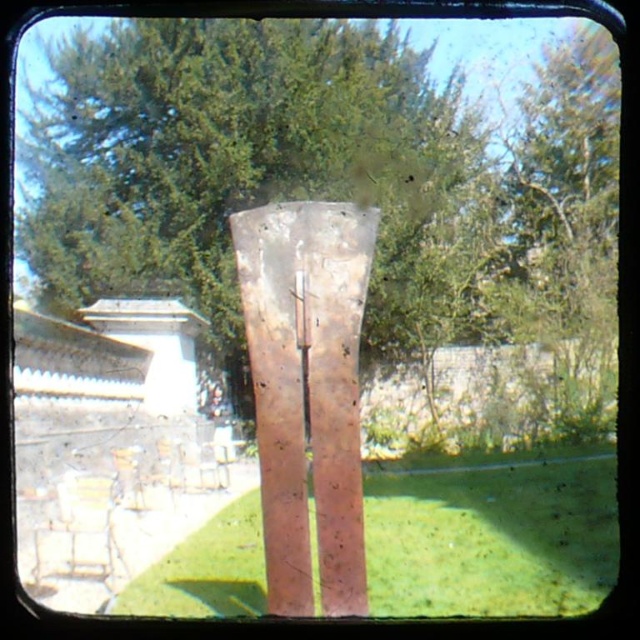
Question: Where is green grass at center located in relation to rusty metal sculpture at center in the image?

Choices:
 (A) right
 (B) left

Answer: (A)

Question: Considering the relative positions of green grass at center and rusty metal sculpture at center in the image provided, where is green grass at center located with respect to rusty metal sculpture at center?

Choices:
 (A) below
 (B) above

Answer: (A)

Question: Does green grass at center have a greater width compared to rusty metal sculpture at center?

Choices:
 (A) yes
 (B) no

Answer: (A)

Question: Which point is closer to the camera taking this photo?

Choices:
 (A) (144, 579)
 (B) (352, 497)

Answer: (B)

Question: Which object appears closest to the camera in this image?

Choices:
 (A) green grass at center
 (B) rusty metal sculpture at center

Answer: (B)

Question: Which point is closer to the camera?

Choices:
 (A) green grass at center
 (B) rusty metal sculpture at center

Answer: (B)